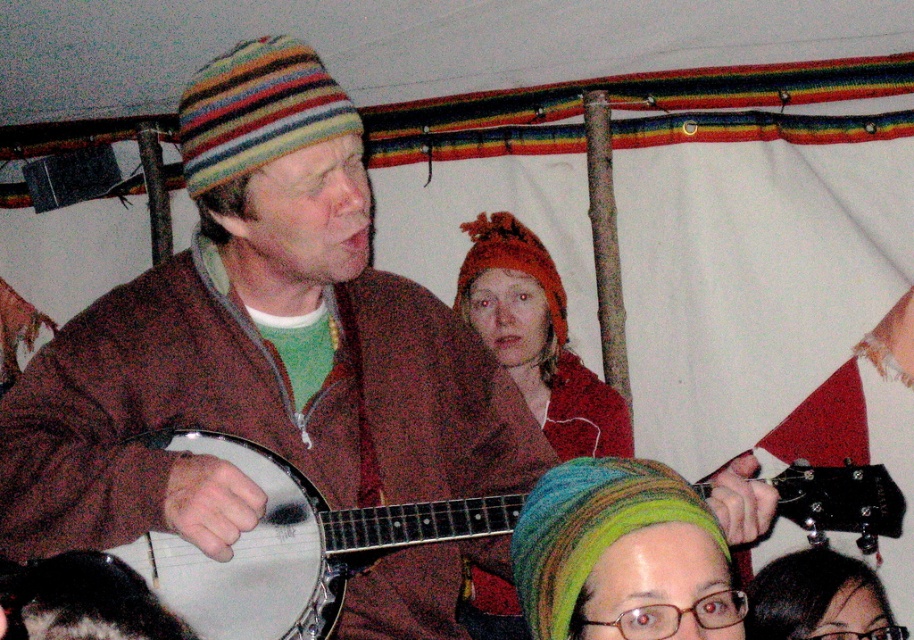
Between white matte banjo at center and knitted woolen hat at center, which one appears on the left side from the viewer's perspective?

From the viewer's perspective, white matte banjo at center appears more on the left side.

Is point (169, 563) in front of point (459, 304)?

Yes, point (169, 563) is in front of point (459, 304).

The image size is (914, 640). What are the coordinates of `white matte banjo at center` in the screenshot? It's located at (291, 547).

Can you confirm if matte brown jacket at center is taller than striped woolen beanie at upper center?

Yes, matte brown jacket at center is taller than striped woolen beanie at upper center.

Is point (226, 230) behind point (203, 129)?

That is True.

The image size is (914, 640). I want to click on matte brown jacket at center, so click(x=257, y=344).

Between point (378, 420) and point (130, 554), which one is positioned behind?

Point (378, 420)

I want to click on matte brown jacket at center, so click(x=257, y=344).